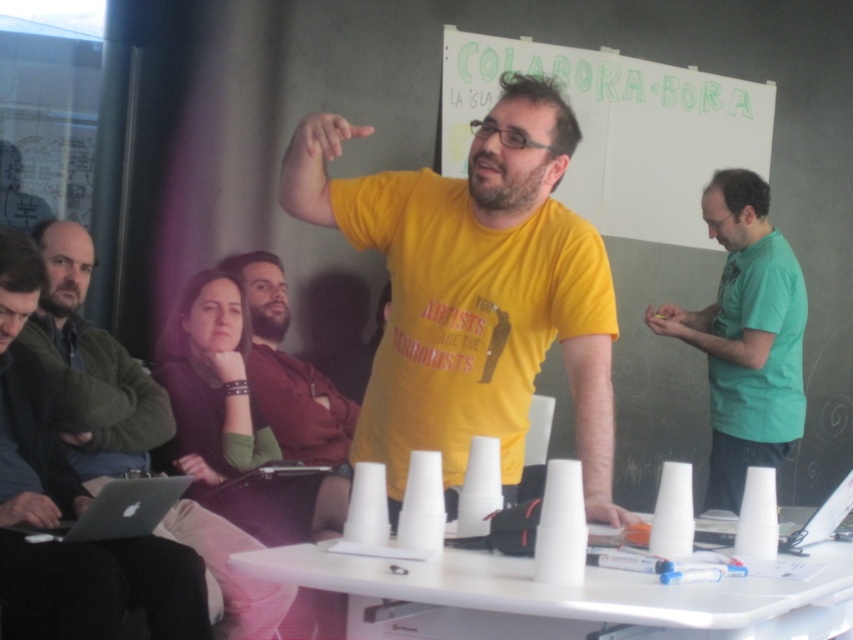
Question: Which object is closer to the camera taking this photo?

Choices:
 (A) matte yellow pencil at upper right
 (B) yellow matte t-shirt at center
 (C) bearded man at center

Answer: (B)

Question: Does yellow matte t-shirt at center have a smaller size compared to white plastic cups at center?

Choices:
 (A) no
 (B) yes

Answer: (A)

Question: Among these points, which one is nearest to the camera?

Choices:
 (A) (709, 316)
 (B) (20, 396)
 (C) (463, 97)
 (D) (602, 509)

Answer: (D)

Question: Does green matte shirt at right have a greater width compared to silver metallic laptop at lower left?

Choices:
 (A) no
 (B) yes

Answer: (B)

Question: Which of these objects is positioned closest to the silver metallic laptop at lower left?

Choices:
 (A) green matte shirt at right
 (B) yellow matte t-shirt at center
 (C) bearded man at center

Answer: (B)

Question: Does matte black laptop at left have a lesser width compared to matte plastic pen at center?

Choices:
 (A) yes
 (B) no

Answer: (B)